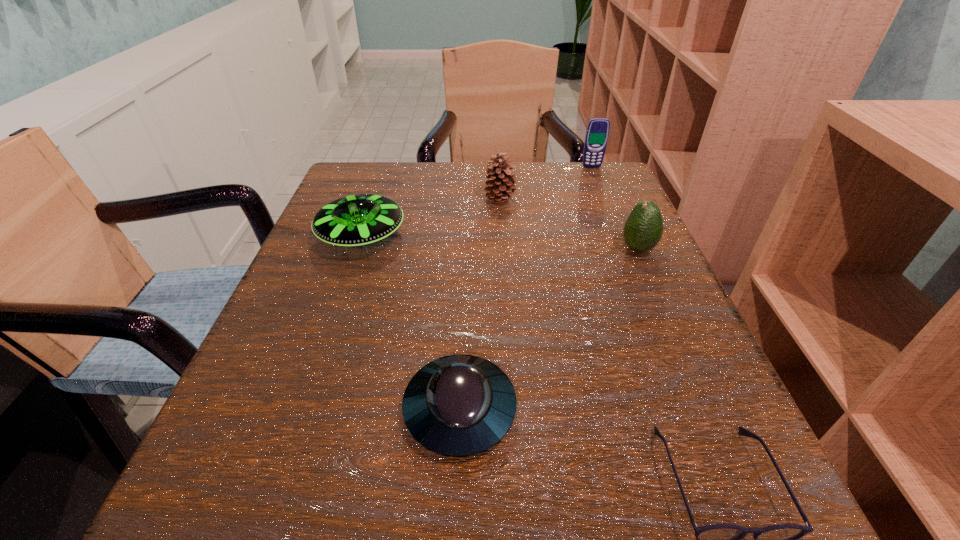
Identify the location of object that is at the far right corner. (597, 132).

The image size is (960, 540). In order to click on vacant space at the far edge of the desktop in this screenshot , I will do `click(429, 185)`.

At what (x,y) coordinates should I click in order to perform the action: click on blank space at the left edge of the desktop. Please return your answer as a coordinate pair (x, y). Looking at the image, I should click on (371, 332).

Where is `vacant region at the right edge`? vacant region at the right edge is located at coordinates (652, 427).

The width and height of the screenshot is (960, 540). I want to click on free region at the far left corner of the desktop, so click(x=388, y=172).

In the image, there is a desktop. Where is `vacant space at the near left corner`? The width and height of the screenshot is (960, 540). vacant space at the near left corner is located at coordinates coord(268,477).

The height and width of the screenshot is (540, 960). I want to click on vacant area at the far right corner, so click(574, 203).

At what (x,y) coordinates should I click in order to perform the action: click on vacant area that lies between the pinecone and the nearer saucer. Please return your answer as a coordinate pair (x, y). The image size is (960, 540). Looking at the image, I should click on (480, 305).

I want to click on free space between the avocado and the right saucer, so click(x=549, y=329).

You are a GUI agent. You are given a task and a screenshot of the screen. Output one action in this format:
    pyautogui.click(x=<x>, y=<y>)
    Task: Click on the unoccupied area between the cellular telephone and the avocado
    This screenshot has width=960, height=540.
    Given the screenshot: What is the action you would take?
    pyautogui.click(x=614, y=208)